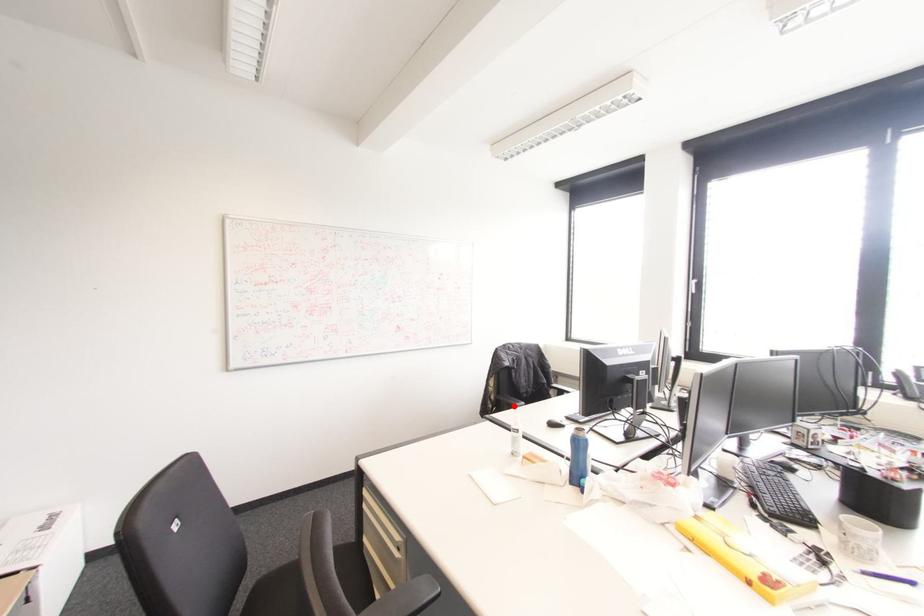
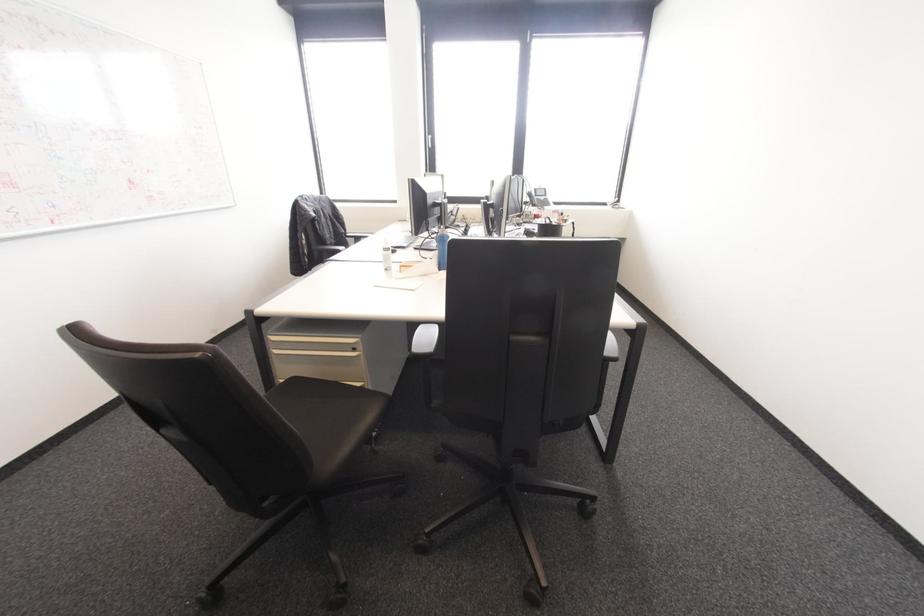
Question: I am providing you with two images of the same scene from different viewpoints. A red point is marked on the first image. At the location where the point appears in image 1, is it still visible in image 2?

Choices:
 (A) Yes
 (B) No

Answer: (A)